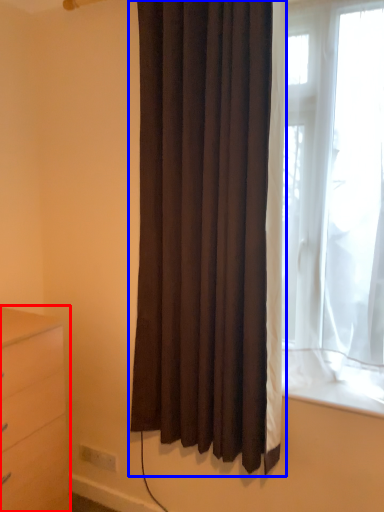
Question: Which object is further to the camera taking this photo, chest of drawers (highlighted by a red box) or curtain (highlighted by a blue box)?

Choices:
 (A) chest of drawers
 (B) curtain

Answer: (A)